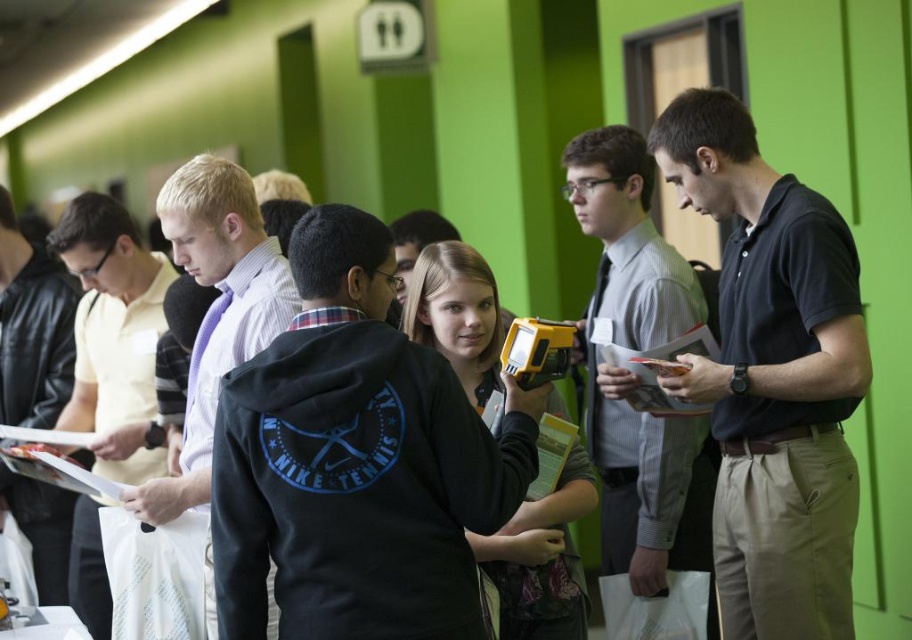
Question: From the image, what is the correct spatial relationship of light purple shirt at left in relation to matte black hoodie at center?

Choices:
 (A) left
 (B) right

Answer: (A)

Question: Which of the following is the farthest from the observer?

Choices:
 (A) matte black hoodie at center
 (B) light brown leather jacket at left

Answer: (B)

Question: Based on their relative distances, which object is farther from the light purple shirt at left?

Choices:
 (A) black hoodie at center
 (B) dark blue shirt at center

Answer: (B)

Question: Does black hoodie at center appear on the right side of matte gray book at center?

Choices:
 (A) yes
 (B) no

Answer: (B)

Question: Which of the following is the closest to the observer?

Choices:
 (A) matte black hoodie at center
 (B) black smooth polo shirt at center
 (C) matte gray book at center
 (D) black hoodie at center

Answer: (D)

Question: Does black hoodie at center appear over light purple shirt at left?

Choices:
 (A) no
 (B) yes

Answer: (B)